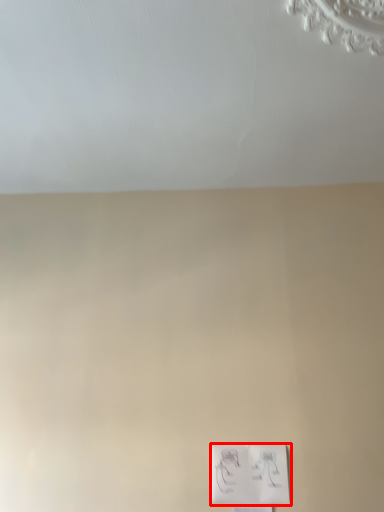
Question: From the image's perspective, where is light switch (annotated by the red box) located relative to backdrop?

Choices:
 (A) above
 (B) below

Answer: (B)